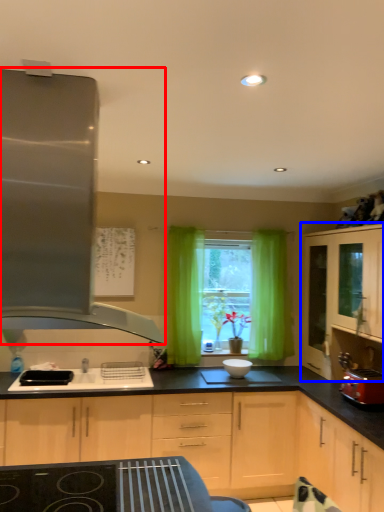
Question: Which object appears farthest to the camera in this image, kitchen appliance (highlighted by a red box) or cabinetry (highlighted by a blue box)?

Choices:
 (A) kitchen appliance
 (B) cabinetry

Answer: (B)